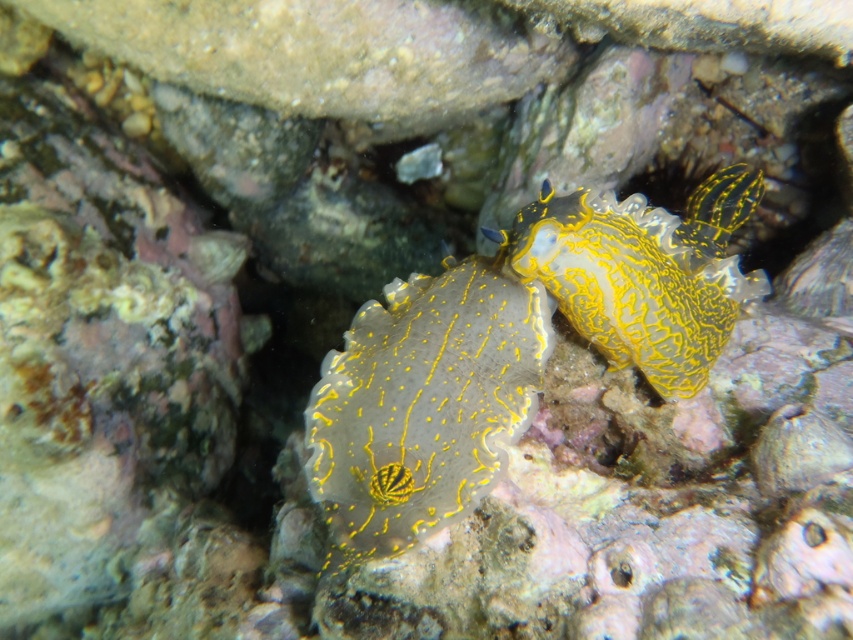
Question: Among these objects, which one is nearest to the camera?

Choices:
 (A) gray-yellow textured sea slug at center
 (B) gray matte sea slug at center

Answer: (B)

Question: Among these points, which one is farthest from the camera?

Choices:
 (A) (599, 333)
 (B) (670, 337)
 (C) (352, 353)

Answer: (A)

Question: Can you confirm if gray-yellow textured sea slug at center is positioned to the left of gray matte sea slug at center?

Choices:
 (A) yes
 (B) no

Answer: (B)

Question: Which point is closer to the camera taking this photo?

Choices:
 (A) (407, 340)
 (B) (717, 349)
 (C) (393, 504)

Answer: (C)

Question: From the image, what is the correct spatial relationship of gray matte sea slug at center in relation to yellow textured sea slug at center?

Choices:
 (A) right
 (B) left

Answer: (B)

Question: Does gray-yellow textured sea slug at center have a lesser width compared to gray matte sea slug at center?

Choices:
 (A) no
 (B) yes

Answer: (A)